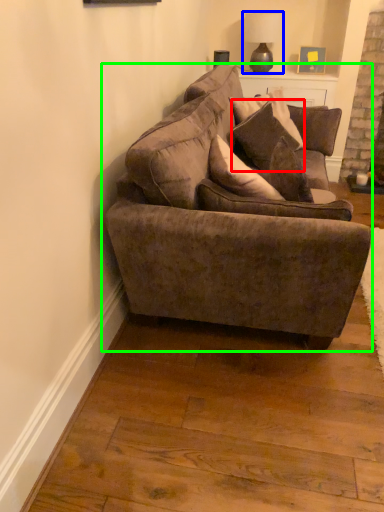
Question: Based on their relative distances, which object is nearer to pillow (highlighted by a red box)? Choose from lamp (highlighted by a blue box) and studio couch (highlighted by a green box).

Choices:
 (A) lamp
 (B) studio couch

Answer: (B)